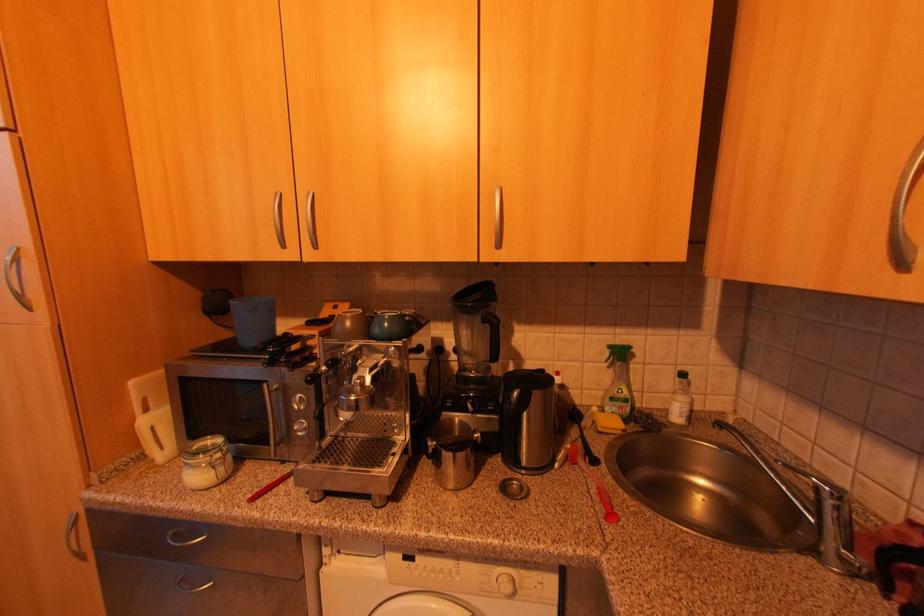
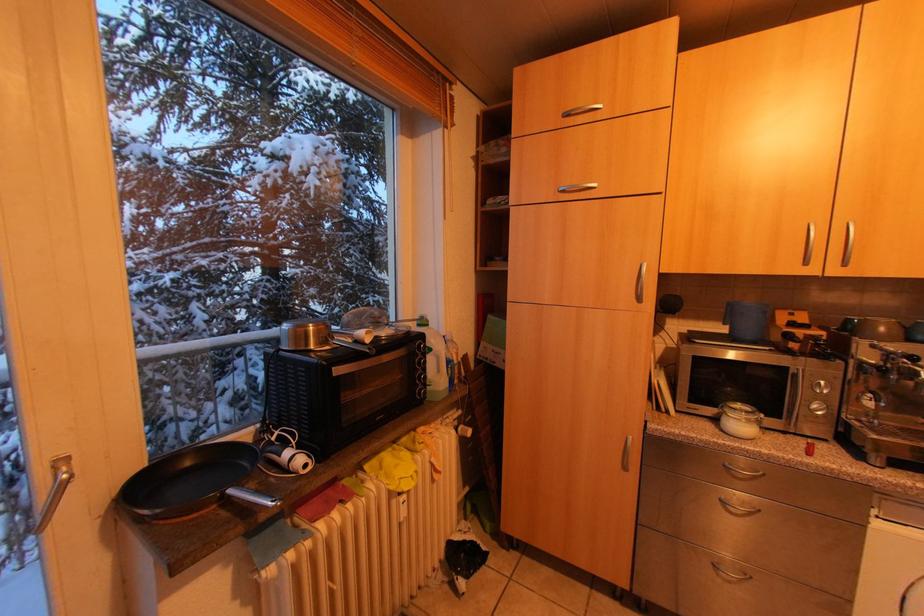
Which direction would the cameraman need to move to produce the second image?

The cameraman walked toward left, backward.